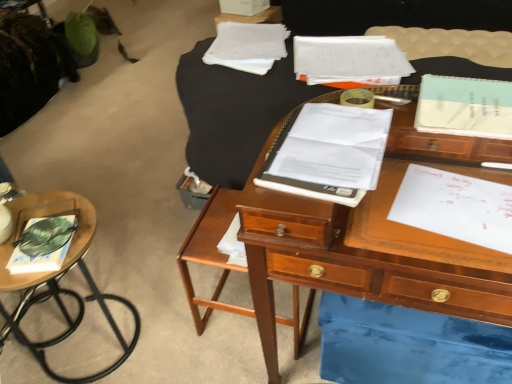
Question: Does point (376, 170) appear closer or farther from the camera than point (459, 205)?

Choices:
 (A) farther
 (B) closer

Answer: (B)

Question: In terms of height, does white paper notebook at center, positioned as the first notebook in front-to-back order, look taller or shorter compared to white paper at right?

Choices:
 (A) short
 (B) tall

Answer: (B)

Question: Which object is positioned closest to the wooden desk at center, positioned as the second table in left-to-right order?

Choices:
 (A) white paper notebook at upper center, the 1th notebook when ordered from back to front
 (B) white paper at right
 (C) white paper notebook at center, positioned as the first notebook in front-to-back order
 (D) wooden side table at lower left, the second table viewed from the right
 (E) light blue spiral notebook at upper right, the 2th notebook in the back-to-front sequence

Answer: (A)

Question: Which object is the farthest from the white paper notebook at center, which ranks as the third notebook in top-to-bottom order?

Choices:
 (A) wooden desk at center, positioned as the second table in left-to-right order
 (B) white paper notebook at upper center, the 3th notebook when ordered from front to back
 (C) light blue spiral notebook at upper right, the first notebook when ordered from right to left
 (D) hardcover book at left
 (E) white paper at right

Answer: (D)